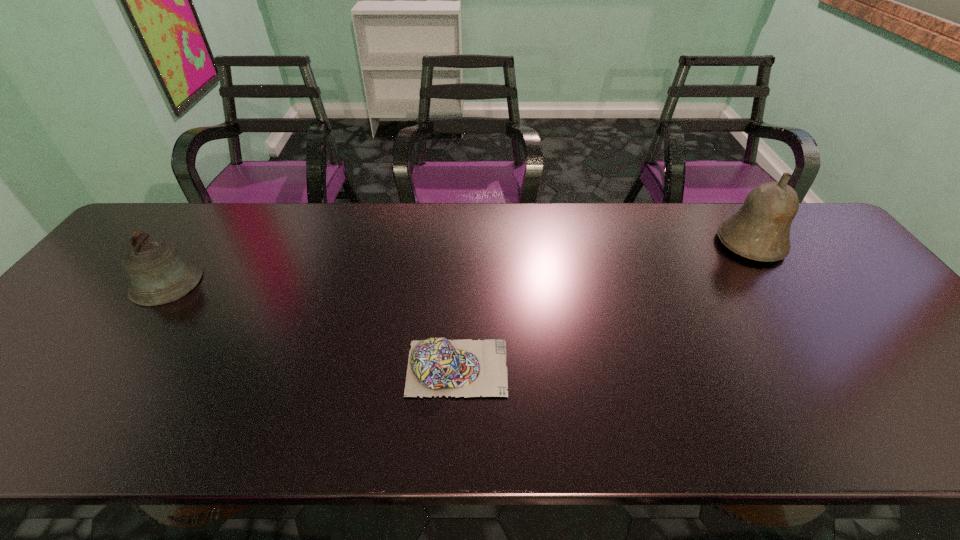
Find the location of a particular element. object located in the left edge section of the desktop is located at coordinates (159, 274).

The height and width of the screenshot is (540, 960). I want to click on object that is at the right edge, so click(x=760, y=230).

Find the location of `object present at the far right corner`. object present at the far right corner is located at coordinates (760, 230).

You are a GUI agent. You are given a task and a screenshot of the screen. Output one action in this format:
    pyautogui.click(x=<x>, y=<y>)
    Task: Click on the vacant space at the far edge
    
    Given the screenshot: What is the action you would take?
    pyautogui.click(x=575, y=206)

You are a GUI agent. You are given a task and a screenshot of the screen. Output one action in this format:
    pyautogui.click(x=<x>, y=<y>)
    Task: Click on the free region at the near edge of the desktop
    The height and width of the screenshot is (540, 960).
    Given the screenshot: What is the action you would take?
    pyautogui.click(x=653, y=422)

Find the location of a particular element. This screenshot has width=960, height=540. vacant region at the far left corner of the desktop is located at coordinates (190, 224).

Where is `vacant position at the near left corner of the desktop`? The height and width of the screenshot is (540, 960). vacant position at the near left corner of the desktop is located at coordinates (14, 415).

In the image, there is a desktop. At what (x,y) coordinates should I click in order to perform the action: click on free region at the far right corner. Please return your answer as a coordinate pair (x, y). Image resolution: width=960 pixels, height=540 pixels. Looking at the image, I should click on (796, 219).

Find the location of a particular element. Image resolution: width=960 pixels, height=540 pixels. unoccupied position between the right bell and the nearest object is located at coordinates (604, 306).

Locate an element on the screen. free space that is in between the second tallest object and the rightmost object is located at coordinates (459, 262).